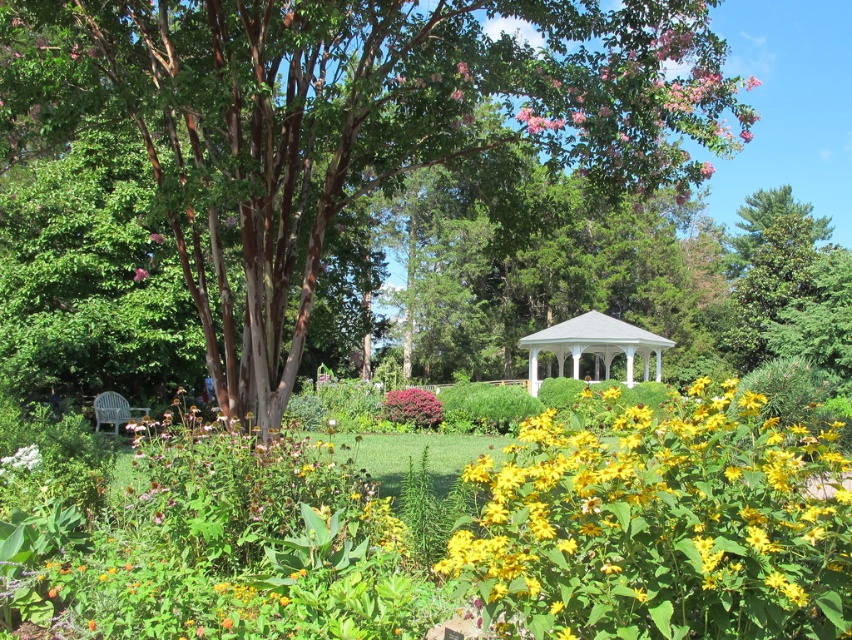
You are planning to install a small garden bench between the brown textured tree at center and the purple matte bush at center. Given that the bench requires 2 meters of space to fit comfortably, is there enough space between them to place the bench?

The brown textured tree at center and purple matte bush at center are 10.21 meters apart, which is more than enough space to accommodate the bench requiring 2 meters of space.

You are standing at the center of the garden and want to find the yellow matte flower at center. According to the coordinates provided, in which direction should you move to locate it?

The yellow matte flower at center is located at coordinates point (661, 524), which is towards the lower right direction from your current position at the center.

You are standing in the garden and want to take a photo of the brown textured tree at center. If your camera has a maximum zoom range of 20 feet, will you be able to capture the tree clearly without moving closer?

The brown textured tree at center is 21.40 feet away from the camera, which exceeds the maximum zoom range of 20 feet. Therefore, you will not be able to capture the tree clearly without moving closer.